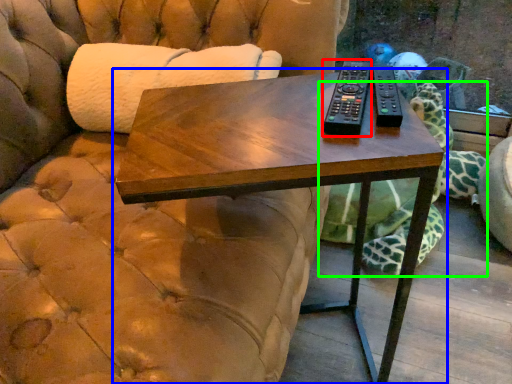
Question: Considering the real-world distances, which object is farthest from remote (highlighted by a red box)? table (highlighted by a blue box) or tortoise (highlighted by a green box)?

Choices:
 (A) table
 (B) tortoise

Answer: (B)